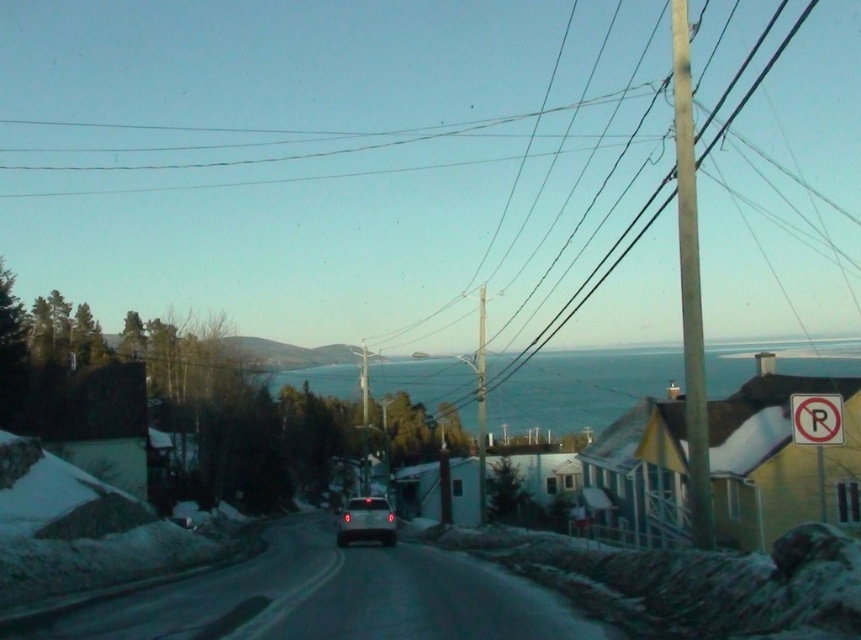
Question: Based on their relative distances, which object is nearer to the smooth wooden utility pole at center?

Choices:
 (A) white plastic no parking sign at right
 (B) white plastic no parking sign at upper right
 (C) satin silver sedan at center
 (D) smooth wooden pole at right

Answer: (C)

Question: Is white plastic no parking sign at right in front of satin silver sedan at center?

Choices:
 (A) no
 (B) yes

Answer: (B)

Question: Which point is closer to the camera?

Choices:
 (A) (691, 131)
 (B) (375, 502)

Answer: (A)

Question: Can you confirm if white plastic no parking sign at right is positioned below satin silver sedan at center?

Choices:
 (A) no
 (B) yes

Answer: (A)

Question: Which of the following is the closest to the observer?

Choices:
 (A) white plastic no parking sign at right
 (B) smooth wooden utility pole at center
 (C) white plastic no parking sign at upper right

Answer: (C)

Question: Is white plastic no parking sign at upper right below smooth wooden utility pole at center?

Choices:
 (A) no
 (B) yes

Answer: (A)